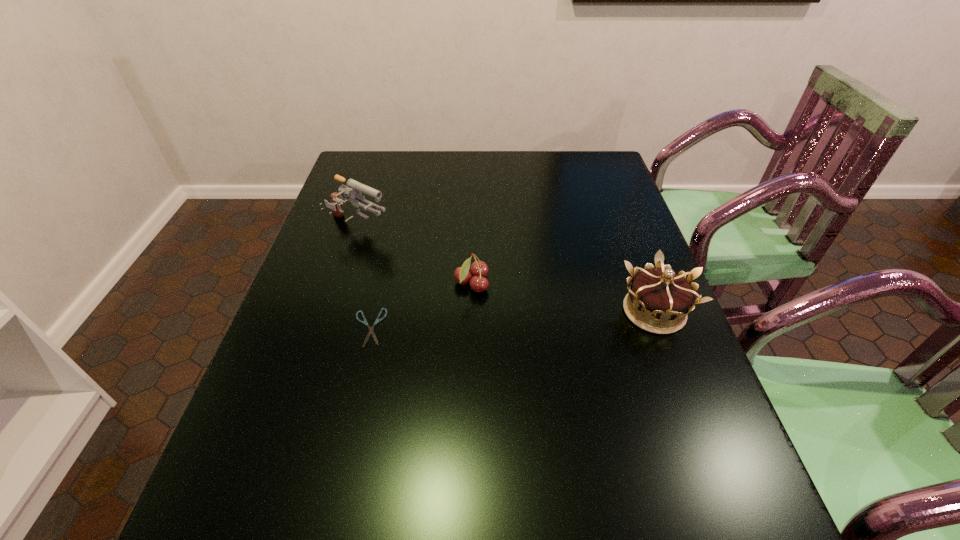
Find the location of a particular element. This screenshot has height=540, width=960. vacant point located between the second shortest object and the farthest object is located at coordinates (415, 256).

At what (x,y) coordinates should I click in order to perform the action: click on free point between the second object from right to left and the gun. Please return your answer as a coordinate pair (x, y). This screenshot has height=540, width=960. Looking at the image, I should click on (415, 256).

Where is `free space between the second shortest object and the crown`? Image resolution: width=960 pixels, height=540 pixels. free space between the second shortest object and the crown is located at coordinates (563, 298).

Find the location of a particular element. Image resolution: width=960 pixels, height=540 pixels. vacant area between the rightmost object and the shears is located at coordinates (512, 319).

Where is `vacant area that lies between the crown and the shears`? Image resolution: width=960 pixels, height=540 pixels. vacant area that lies between the crown and the shears is located at coordinates (512, 319).

Where is `free space between the cherry and the shortest object`? This screenshot has width=960, height=540. free space between the cherry and the shortest object is located at coordinates (420, 306).

The image size is (960, 540). In order to click on vacant area that lies between the crown and the shortest object in this screenshot , I will do pyautogui.click(x=512, y=319).

Identify the location of empty space between the cherry and the gun. (415, 256).

What are the coordinates of `empty location between the shears and the gun` in the screenshot? It's located at (364, 278).

This screenshot has height=540, width=960. I want to click on object that stands as the second closest to the shears, so click(353, 189).